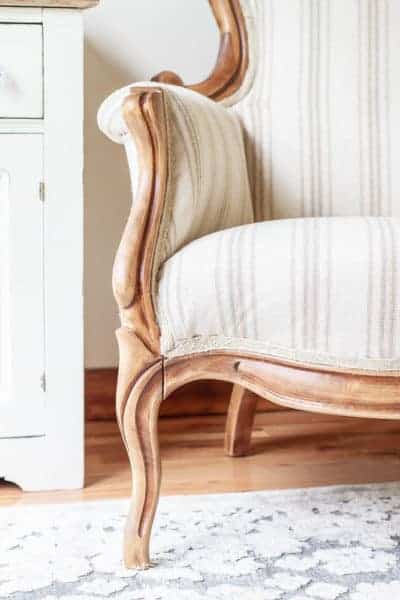
Identify the location of upholstered chair. [331, 128].